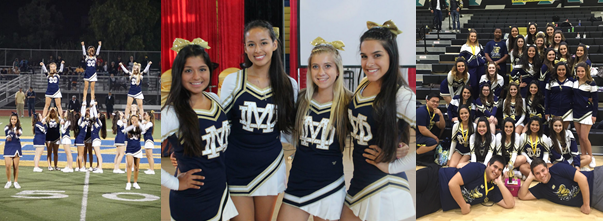
Locate an element on the screen. The width and height of the screenshot is (603, 221). white wall is located at coordinates (323, 15).